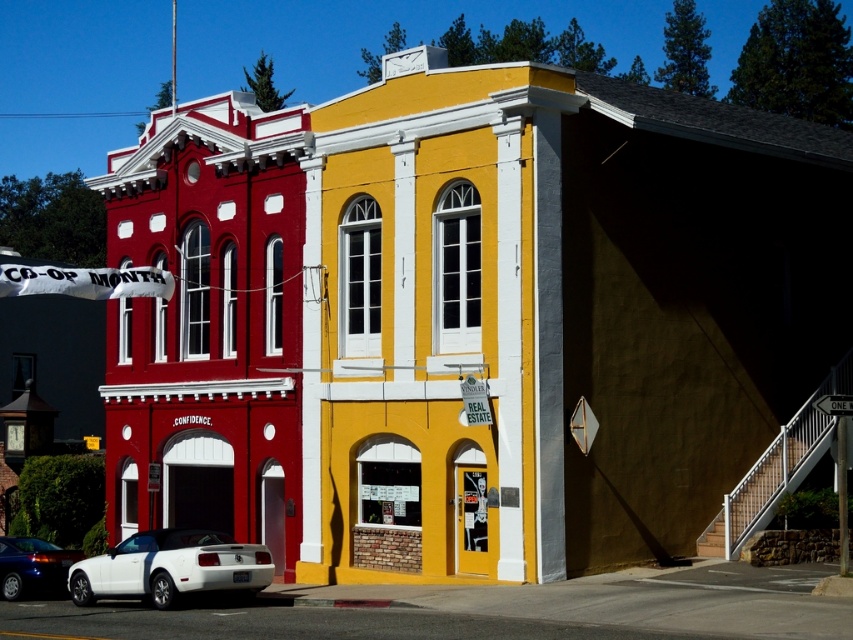
Which of these two, white matte convertible at lower left or metallic blue car at lower left, stands shorter?

white matte convertible at lower left

Can you confirm if white matte convertible at lower left is positioned to the left of metallic blue car at lower left?

Incorrect, white matte convertible at lower left is not on the left side of metallic blue car at lower left.

Is point (102, 572) behind point (47, 592)?

No, it is not.

Image resolution: width=853 pixels, height=640 pixels. I want to click on white matte convertible at lower left, so click(170, 566).